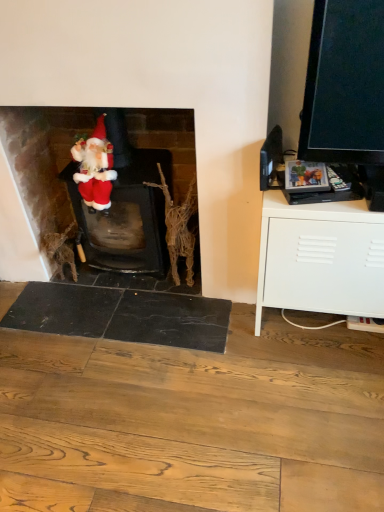
Question: From their relative heights in the image, would you say matte red santa at left is taller or shorter than white matte cabinet at right?

Choices:
 (A) tall
 (B) short

Answer: (B)

Question: Which is correct: matte red santa at left is inside white matte cabinet at right, or outside of it?

Choices:
 (A) inside
 (B) outside

Answer: (B)

Question: Which object is positioned closest to the white matte cabinet at right?

Choices:
 (A) velvet red santa at center
 (B) matte red santa at left
 (C) bark-like textured branch at center

Answer: (C)

Question: Which of these objects is positioned closest to the bark-like textured branch at center?

Choices:
 (A) velvet red santa at center
 (B) white matte cabinet at right
 (C) matte red santa at left

Answer: (C)